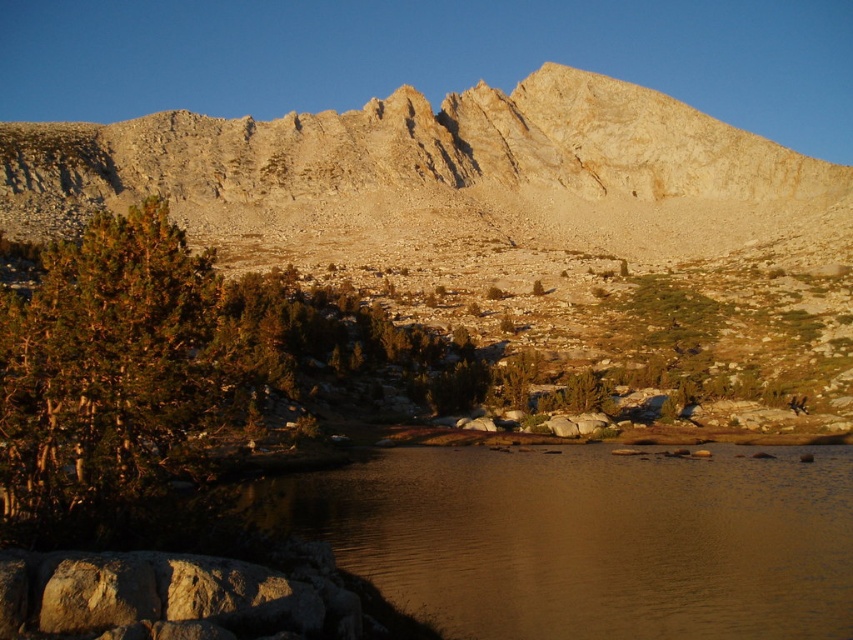
Question: Estimate the real-world distances between objects in this image. Which object is closer to the brown water at center?

Choices:
 (A) smooth gray rock at center
 (B) green shrubbery at lower left

Answer: (A)

Question: Considering the relative positions of green shrubbery at lower left and brown water at center in the image provided, where is green shrubbery at lower left located with respect to brown water at center?

Choices:
 (A) left
 (B) right

Answer: (B)

Question: Does green shrubbery at lower left come in front of brown water at center?

Choices:
 (A) yes
 (B) no

Answer: (B)

Question: Which is farther from the brown water at center?

Choices:
 (A) green shrubbery at lower left
 (B) smooth gray rock at center

Answer: (A)

Question: Can you confirm if brown water at center is thinner than smooth gray rock at center?

Choices:
 (A) yes
 (B) no

Answer: (B)

Question: Based on their relative distances, which object is nearer to the brown water at center?

Choices:
 (A) green shrubbery at lower left
 (B) smooth gray rock at center

Answer: (B)